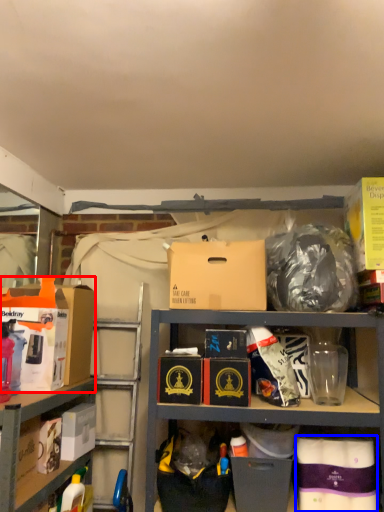
Question: Which of the following is the farthest to the observer, box (highlighted by a red box) or box (highlighted by a blue box)?

Choices:
 (A) box
 (B) box

Answer: (A)